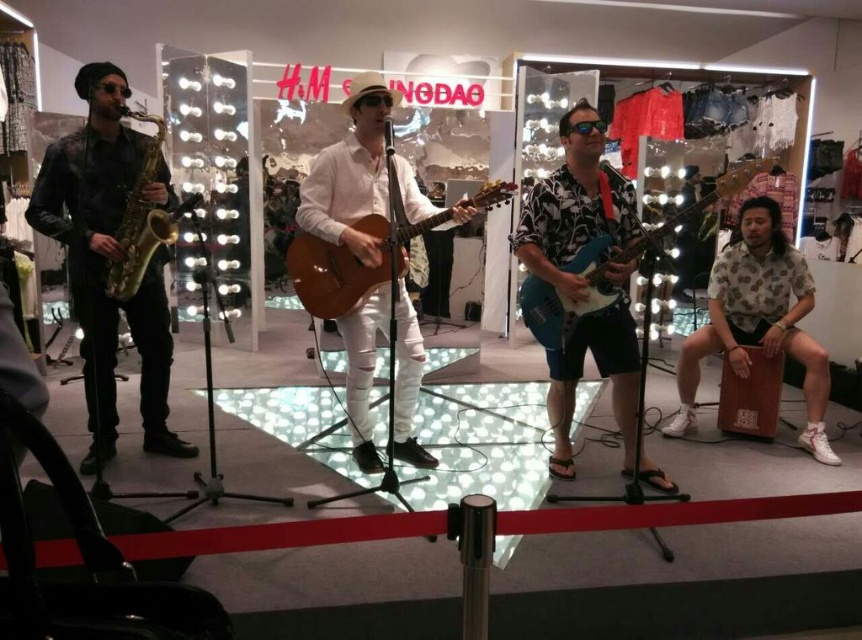
Question: Based on their relative distances, which object is farther from the floral-patterned shirt at center?

Choices:
 (A) blue glossy electric guitar at center
 (B) white matte shirt at center
 (C) matte brown acoustic guitar at center

Answer: (B)

Question: Does floral-patterned shirt at center have a greater width compared to matte brown acoustic guitar at center?

Choices:
 (A) yes
 (B) no

Answer: (B)

Question: Is shiny gold saxophone at left further to camera compared to white matte shirt at center?

Choices:
 (A) yes
 (B) no

Answer: (B)

Question: Observing the image, what is the correct spatial positioning of brown wood cajon at right in reference to blue glossy electric guitar at center?

Choices:
 (A) below
 (B) above

Answer: (A)

Question: Estimate the real-world distances between objects in this image. Which object is closer to the brown wood cajon at right?

Choices:
 (A) floral-patterned shirt at center
 (B) blue glossy electric guitar at center
 (C) matte brown acoustic guitar at center

Answer: (A)

Question: Based on their relative distances, which object is farther from the white matte shirt at center?

Choices:
 (A) brown wood cajon at right
 (B) floral-patterned shirt at center
 (C) blue glossy electric guitar at center

Answer: (A)